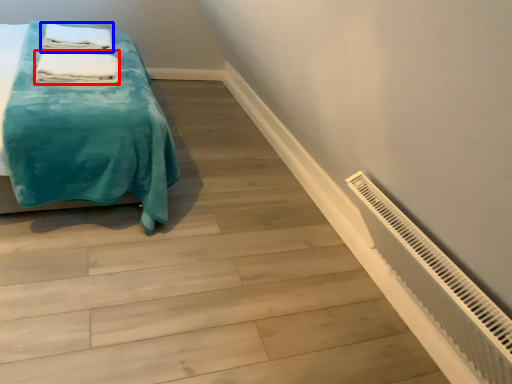
Question: Which object is further to the camera taking this photo, bath towel (highlighted by a red box) or bath towel (highlighted by a blue box)?

Choices:
 (A) bath towel
 (B) bath towel

Answer: (B)